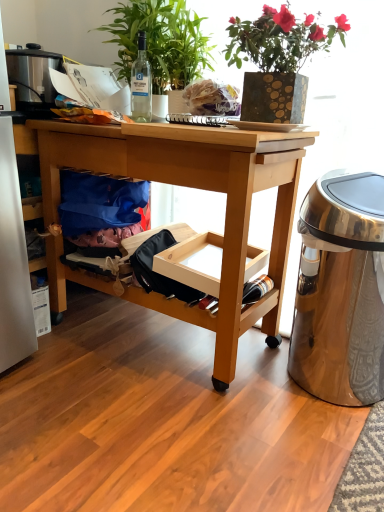
This screenshot has width=384, height=512. I want to click on vacant area that is in front of polished metallic trash can at right, so click(318, 449).